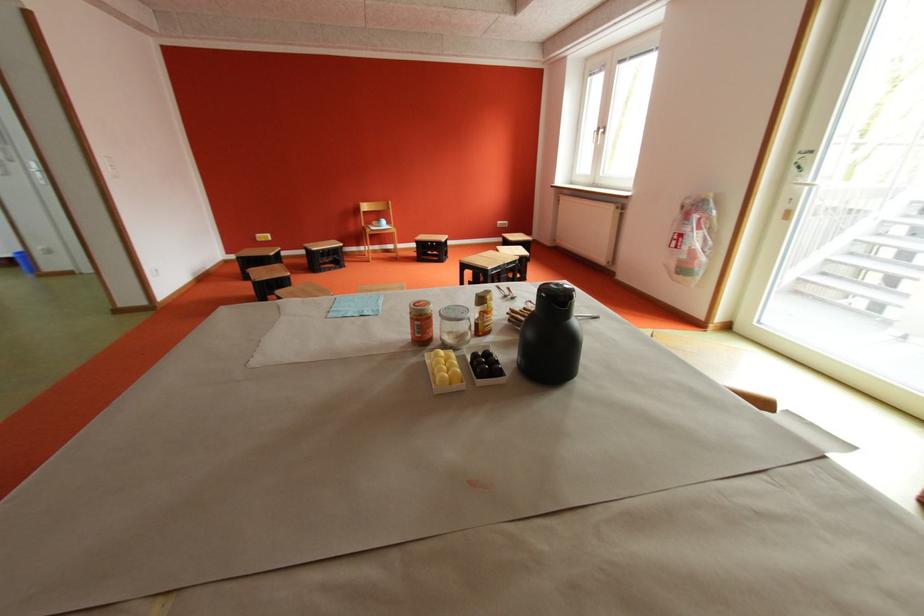
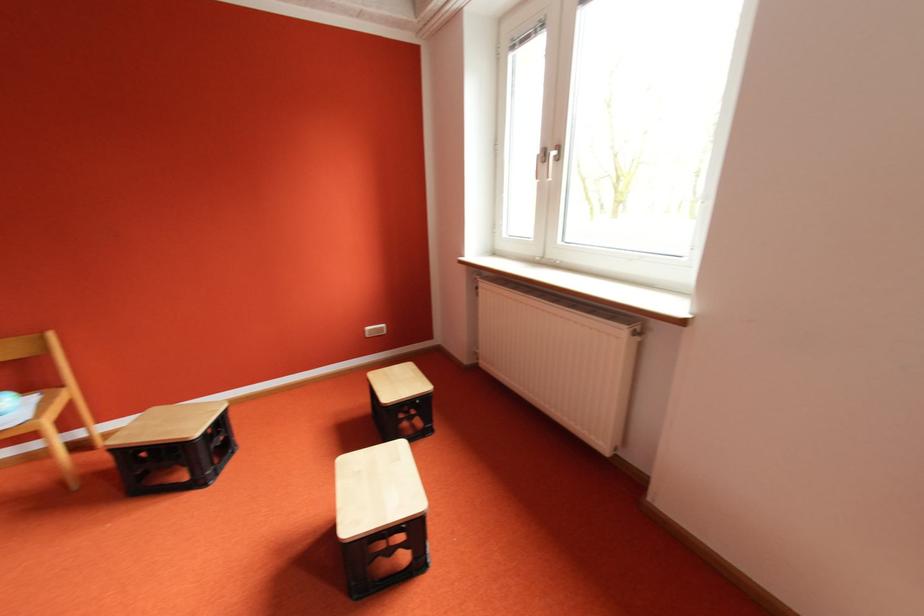
Locate, in the second image, the point that corresponds to (507,227) in the first image.

(377, 336)